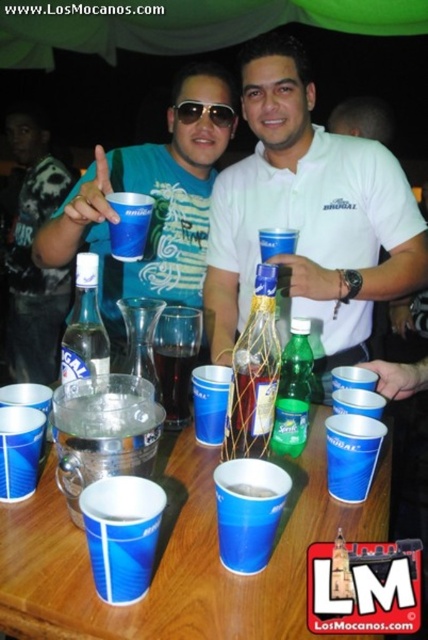
Is brushed metal cup at upper center above sunglasses at center?

No, brushed metal cup at upper center is not above sunglasses at center.

Does brushed metal cup at upper center have a lesser width compared to sunglasses at center?

No, brushed metal cup at upper center is not thinner than sunglasses at center.

Locate an element on the screen. The width and height of the screenshot is (428, 640). brushed metal cup at upper center is located at coordinates (30, 253).

What do you see at coordinates (255, 372) in the screenshot? I see `translucent glass bottle at center` at bounding box center [255, 372].

Which is in front, point (267, 296) or point (73, 305)?

Point (267, 296) is in front.

Where is `translucent glass bottle at center`? translucent glass bottle at center is located at coordinates (255, 372).

Who is positioned more to the right, green glass bottle at center or sunglasses at center?

green glass bottle at center

Between point (299, 381) and point (217, 106), which one is positioned in front?

Positioned in front is point (299, 381).

What are the coordinates of `green glass bottle at center` in the screenshot? It's located at (294, 392).